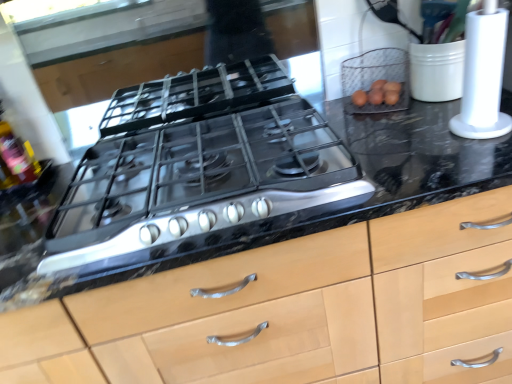
Locate an element on the screen. Image resolution: width=512 pixels, height=384 pixels. vacant area in front of translucent plastic bottle at left is located at coordinates (22, 215).